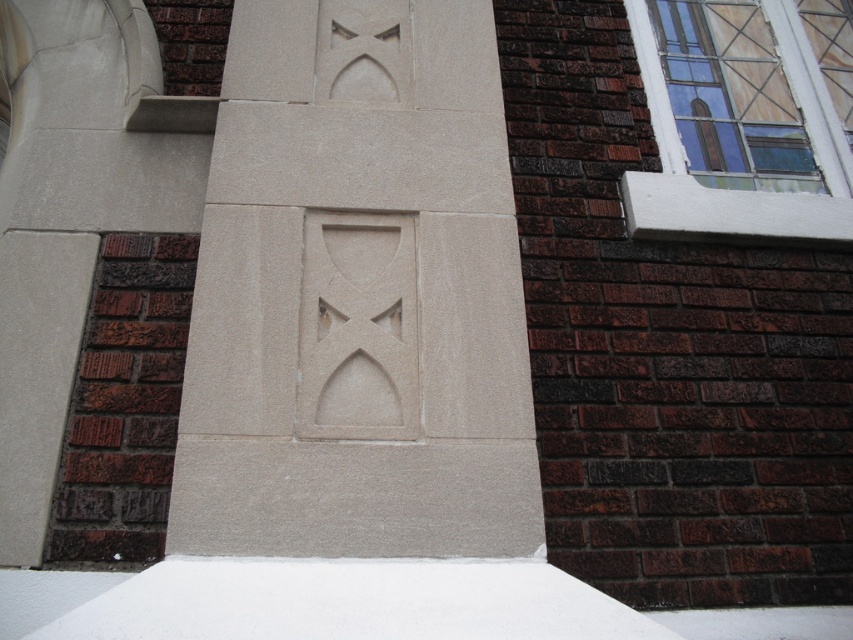
You are a window cleaner with a ladder that can reach up to 1.5 meters. You need to clean the clear glass window at upper right and the white matte snow at bottom. Can you safely clean both without moving the ladder?

The distance between the clear glass window at upper right and the white matte snow at bottom is 1.58 meters. Since your ladder can only reach up to 1.5 meters, you cannot safely clean both without moving the ladder.

You are standing in front of the building and want to see the white matte snow at bottom through the clear glass window at upper right. Is this possible?

The white matte snow at bottom is behind the clear glass window at upper right, so you cannot see it through the window from the front of the building.

You are standing 2 meters away from the building exterior. You want to touch the point at coordinate (401, 193) on the wall. Can you reach it without moving closer?

The point at coordinate (401, 193) is 1.71 meters from the camera, so yes, you can reach it without moving closer since you are already 2 meters away.